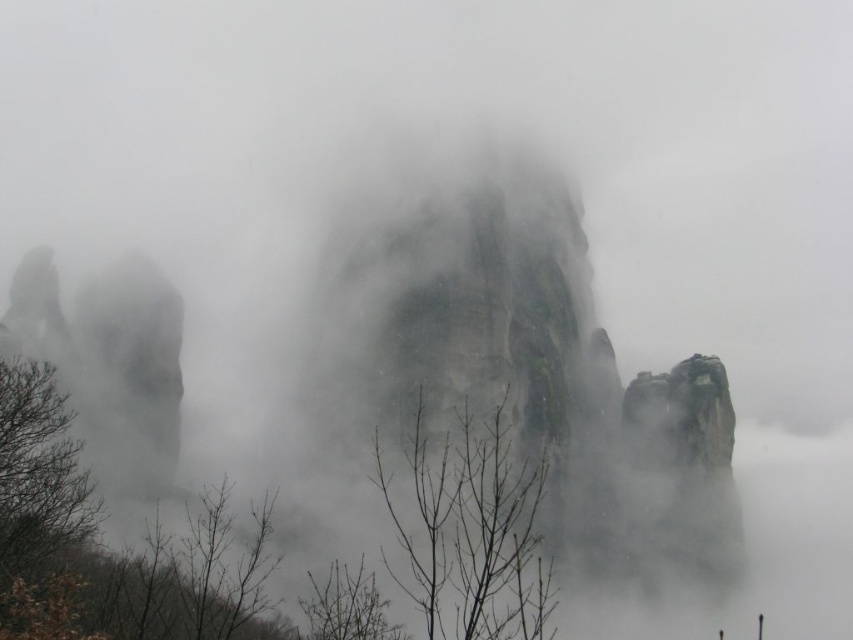
How much distance is there between brown leafy tree at lower left and brown leafless branches at lower left?

They are 11.17 feet apart.

Does brown leafy tree at lower left appear under brown leafless branches at lower left?

Yes, brown leafy tree at lower left is below brown leafless branches at lower left.

What do you see at coordinates (112, 550) in the screenshot? I see `brown leafy tree at lower left` at bounding box center [112, 550].

Image resolution: width=853 pixels, height=640 pixels. I want to click on brown leafy tree at lower left, so click(112, 550).

Describe the element at coordinates (39, 506) in the screenshot. I see `brown leafless branches at lower left` at that location.

Based on the photo, does brown leafless branches at lower left have a smaller size compared to brown leafless tree at lower center?

Incorrect, brown leafless branches at lower left is not smaller in size than brown leafless tree at lower center.

Find the location of `brown leafless branches at lower left`. brown leafless branches at lower left is located at coordinates (39, 506).

I want to click on brown leafless branches at lower left, so click(x=39, y=506).

Does brown leafy tree at lower left have a greater width compared to brown bare branches at center?

Indeed, brown leafy tree at lower left has a greater width compared to brown bare branches at center.

Is brown leafy tree at lower left further to the viewer compared to brown bare branches at center?

Yes, brown leafy tree at lower left is behind brown bare branches at center.

Who is more distant from viewer, (265,508) or (412,449)?

The point (412,449) is behind.

At what (x,y) coordinates should I click in order to perform the action: click on brown leafy tree at lower left. Please return your answer as a coordinate pair (x, y). Looking at the image, I should click on (112, 550).